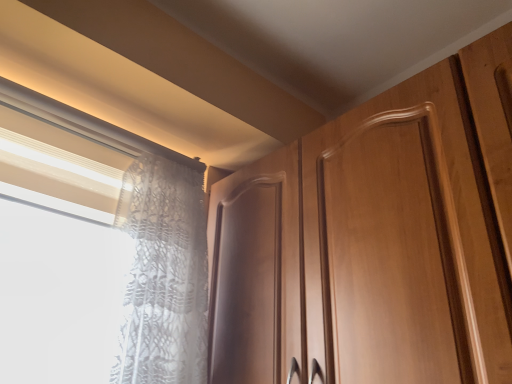
Where is `white lace curtain at upper left`? The height and width of the screenshot is (384, 512). white lace curtain at upper left is located at coordinates (149, 244).

This screenshot has height=384, width=512. Describe the element at coordinates (149, 244) in the screenshot. I see `white lace curtain at upper left` at that location.

Where is `white lace curtain at left`? This screenshot has width=512, height=384. white lace curtain at left is located at coordinates (163, 275).

Describe the element at coordinates (163, 275) in the screenshot. I see `white lace curtain at left` at that location.

Where is `white lace curtain at upper left`? This screenshot has width=512, height=384. white lace curtain at upper left is located at coordinates (149, 244).

Which is more to the right, white lace curtain at left or white lace curtain at upper left?

white lace curtain at left.

Which object is more forward, white lace curtain at left or white lace curtain at upper left?

Positioned in front is white lace curtain at upper left.

Between point (163, 221) and point (22, 89), which one is positioned in front?

The point (22, 89) is in front.

From the image's perspective, is white lace curtain at left below white lace curtain at upper left?

Yes, from the image's perspective, white lace curtain at left is below white lace curtain at upper left.

From a real-world perspective, is white lace curtain at left physically located above or below white lace curtain at upper left?

Clearly, from a real-world perspective, white lace curtain at left is below white lace curtain at upper left.

Based on the photo, does white lace curtain at left have a greater width compared to white lace curtain at upper left?

Yes, white lace curtain at left is wider than white lace curtain at upper left.

Who is taller, white lace curtain at left or white lace curtain at upper left?

With more height is white lace curtain at left.

Looking at this image, who is smaller, white lace curtain at left or white lace curtain at upper left?

white lace curtain at upper left is smaller.

In the scene shown: Would you say white lace curtain at left is inside or outside white lace curtain at upper left?

white lace curtain at left lies outside white lace curtain at upper left.

Based on the photo, is white lace curtain at left not close to white lace curtain at upper left?

Actually, white lace curtain at left and white lace curtain at upper left are a little close together.

Is white lace curtain at left facing away from white lace curtain at upper left?

No, white lace curtain at left is not facing the opposite direction of white lace curtain at upper left.

How many degrees apart are the facing directions of white lace curtain at left and white lace curtain at upper left?

3.53 degrees.

The height and width of the screenshot is (384, 512). I want to click on curtain that appears on the right of white lace curtain at upper left, so click(163, 275).

Is white lace curtain at upper left at the left side of white lace curtain at left?

Yes.

Which object is further away from the camera taking this photo, white lace curtain at upper left or white lace curtain at left?

white lace curtain at left is further away from the camera.

Considering the points (159, 246) and (159, 282), which point is in front, point (159, 246) or point (159, 282)?

The point (159, 282) is in front.

From the image's perspective, between white lace curtain at upper left and white lace curtain at left, who is located below?

white lace curtain at left, from the image's perspective.

From a real-world perspective, which is physically above, white lace curtain at upper left or white lace curtain at left?

white lace curtain at upper left.

Which object is thinner, white lace curtain at upper left or white lace curtain at left?

white lace curtain at upper left is thinner.

Between white lace curtain at upper left and white lace curtain at left, which one has less height?

With less height is white lace curtain at upper left.

Is white lace curtain at upper left bigger than white lace curtain at left?

Actually, white lace curtain at upper left might be smaller than white lace curtain at left.

Is white lace curtain at upper left spatially inside white lace curtain at left, or outside of it?

white lace curtain at upper left is spatially situated outside white lace curtain at left.

Looking at this image, is white lace curtain at upper left positioned far away from white lace curtain at left?

No, white lace curtain at upper left is in close proximity to white lace curtain at left.

Is white lace curtain at left at the back of white lace curtain at upper left?

That's not correct — white lace curtain at upper left is not looking away from white lace curtain at left.

In the scene shown: What's the angular difference between white lace curtain at upper left and white lace curtain at left's facing directions?

The angular difference between white lace curtain at upper left and white lace curtain at left is 3.53 degrees.

The image size is (512, 384). I want to click on curtain below the white lace curtain at upper left (from a real-world perspective), so click(x=163, y=275).

The height and width of the screenshot is (384, 512). In order to click on curtain behind the white lace curtain at upper left in this screenshot , I will do `click(163, 275)`.

Find the location of a particular element. This screenshot has height=384, width=512. window above the white lace curtain at left (from a real-world perspective) is located at coordinates (149, 244).